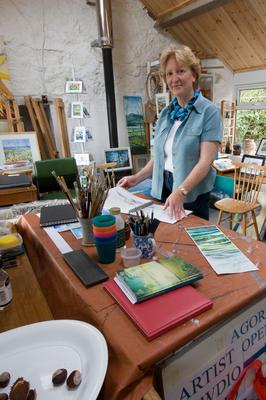
You are a GUI agent. You are given a task and a screenshot of the screen. Output one action in this format:
    pyautogui.click(x=<x>, y=<y>)
    Task: Click on the table
    
    Given the screenshot: What is the action you would take?
    pyautogui.click(x=178, y=237)